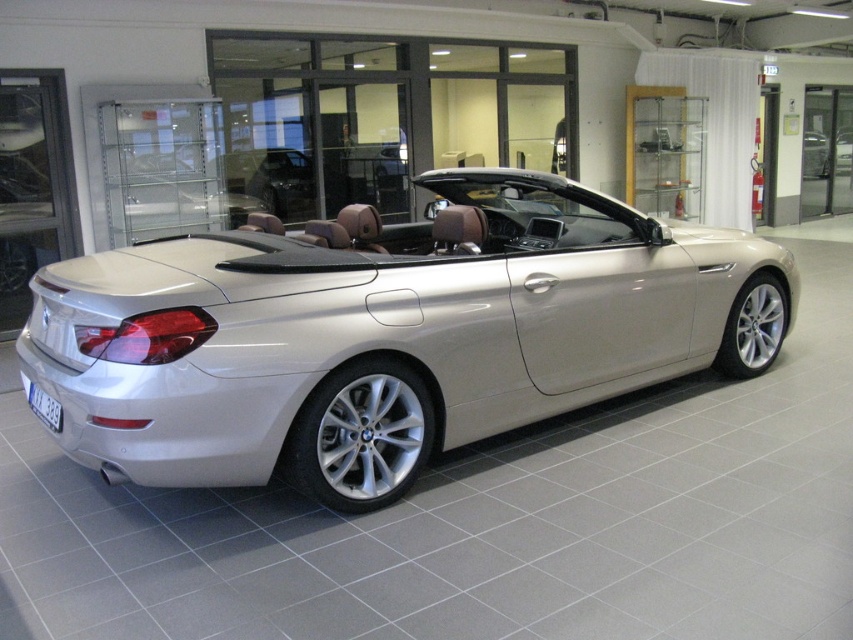
You are a delivery person trying to park a new car in a narrow garage. The garage has a width restriction of 2 meters. You have the satin silver convertible at center and the black plastic license plate at rear in your vehicle. Based on their widths, can you safely park the car without hitting the sides of the garage?

The satin silver convertible at center is wider than the black plastic license plate at rear. Since the garage has a 2 meters width restriction, and the car is wider than the license plate, you need to ensure the car fits within the 2 meters. However, without knowing the exact width of the car, it is impossible to determine if it will fit. Please check the car dimensions before proceeding.